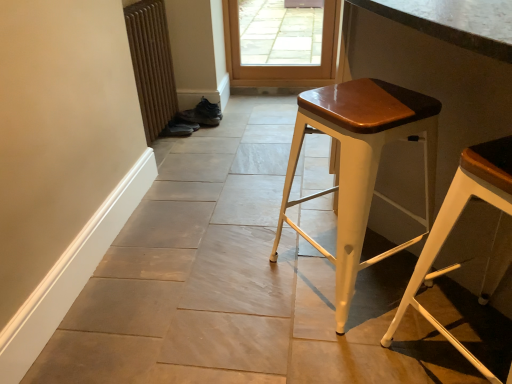
Question: Considering the positions of leather brown shoe at center, the 1th shoe viewed from the top, and matte white stool at center, which is counted as the second stool, starting from the right, in the image, is leather brown shoe at center, the 1th shoe viewed from the top, bigger or smaller than matte white stool at center, which is counted as the second stool, starting from the right,?

Choices:
 (A) small
 (B) big

Answer: (A)

Question: Visually, is leather brown shoe at center, the 2th shoe when ordered from bottom to top, positioned to the left or to the right of matte white stool at center, which is the 1th stool from left to right?

Choices:
 (A) right
 (B) left

Answer: (B)

Question: Which of these objects is positioned farthest from the matte white stool at center, which is counted as the second stool, starting from the right?

Choices:
 (A) leather brown shoe at center, the 2th shoe when ordered from bottom to top
 (B) shiny black shoe at lower center, which is the 2th shoe in top-to-bottom order
 (C) brown textured radiator at lower left
 (D) white metal stool at right, marked as the 1th stool in a right-to-left arrangement

Answer: (A)

Question: Considering the real-world distances, which object is farthest from the brown textured radiator at lower left?

Choices:
 (A) matte white stool at center, which is the 1th stool from left to right
 (B) shiny black shoe at lower center, which is the 2th shoe in top-to-bottom order
 (C) white metal stool at right, marked as the 1th stool in a right-to-left arrangement
 (D) leather brown shoe at center, the 2th shoe when ordered from bottom to top

Answer: (C)